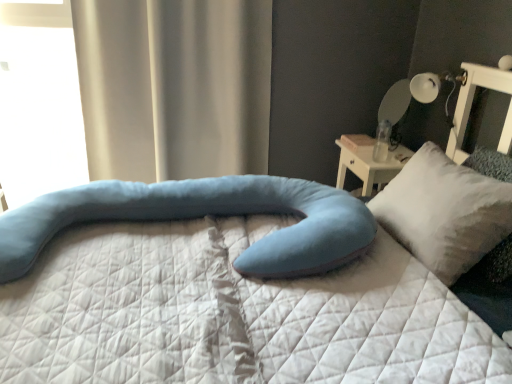
In order to face soft blue fabric pillow at center, marked as the 1th pillow in a left-to-right arrangement, should I rotate leftwards or rightwards?

Turn left approximately 9.121 degrees to face it.

How much space does soft blue fabric pillow at center, placed as the 2th pillow when sorted from right to left, occupy horizontally?

4.47 feet.

The image size is (512, 384). Describe the element at coordinates (433, 87) in the screenshot. I see `white glossy table lamp at upper right` at that location.

You are a GUI agent. You are given a task and a screenshot of the screen. Output one action in this format:
    pyautogui.click(x=<x>, y=<y>)
    Task: Click on the white soft pillow at right, which ranks as the 1th pillow in right-to-left order
    
    Given the screenshot: What is the action you would take?
    pyautogui.click(x=444, y=212)

Is transparent glass window at upper left shorter than white glossy table lamp at upper right?

No.

From a real-world perspective, who is located lower, transparent glass window at upper left or white glossy table lamp at upper right?

transparent glass window at upper left.

Would you say white glossy table lamp at upper right is part of transparent glass window at upper left's contents?

No, white glossy table lamp at upper right is located outside of transparent glass window at upper left.

Considering the relative sizes of transparent glass window at upper left and white glossy table lamp at upper right in the image provided, is transparent glass window at upper left bigger than white glossy table lamp at upper right?

Indeed, transparent glass window at upper left has a larger size compared to white glossy table lamp at upper right.

Is white soft pillow at right, which ranks as the 1th pillow in right-to-left order, with transparent glass window at upper left?

No, white soft pillow at right, which ranks as the 1th pillow in right-to-left order, is not beside transparent glass window at upper left.

Is white soft pillow at right, arranged as the second pillow when viewed from the left, at the left side of transparent glass window at upper left?

No, white soft pillow at right, arranged as the second pillow when viewed from the left, is not to the left of transparent glass window at upper left.

Is point (483, 182) closer or farther from the camera than point (34, 15)?

Point (483, 182).

The width and height of the screenshot is (512, 384). I want to click on the 2nd pillow to the right of the transparent glass window at upper left, starting your count from the anchor, so click(x=444, y=212).

Is white soft pillow at right, which ranks as the 1th pillow in right-to-left order, taller or shorter than white glossy table lamp at upper right?

Considering their sizes, white soft pillow at right, which ranks as the 1th pillow in right-to-left order, has more height than white glossy table lamp at upper right.

Can we say white soft pillow at right, arranged as the second pillow when viewed from the left, lies outside white glossy table lamp at upper right?

white soft pillow at right, arranged as the second pillow when viewed from the left, lies outside white glossy table lamp at upper right's area.

From a real-world perspective, is white soft pillow at right, arranged as the second pillow when viewed from the left, over white glossy table lamp at upper right?

Incorrect, from a real-world perspective, white soft pillow at right, arranged as the second pillow when viewed from the left, is lower than white glossy table lamp at upper right.

Find the location of a particular element. table lamp above the white soft pillow at right, arranged as the second pillow when viewed from the left (from the image's perspective) is located at coordinates (433, 87).

Is satin beige curtain at upper left next to transparent glass window at upper left and touching it?

No, satin beige curtain at upper left is not with transparent glass window at upper left.

Which is behind, satin beige curtain at upper left or transparent glass window at upper left?

Positioned behind is transparent glass window at upper left.

How many degrees apart are the facing directions of satin beige curtain at upper left and transparent glass window at upper left?

They differ by 0.155 degrees in their facing directions.

From the image's perspective, which one is positioned higher, satin beige curtain at upper left or transparent glass window at upper left?

transparent glass window at upper left is shown above in the image.

Is soft blue fabric pillow at center, marked as the 1th pillow in a left-to-right arrangement, at the back of transparent glass window at upper left?

No, transparent glass window at upper left is not facing away from soft blue fabric pillow at center, marked as the 1th pillow in a left-to-right arrangement.

From the picture: Between transparent glass window at upper left and soft blue fabric pillow at center, marked as the 1th pillow in a left-to-right arrangement, which one has larger size?

soft blue fabric pillow at center, marked as the 1th pillow in a left-to-right arrangement, is bigger.

From a real-world perspective, who is located lower, transparent glass window at upper left or soft blue fabric pillow at center, marked as the 1th pillow in a left-to-right arrangement?

soft blue fabric pillow at center, marked as the 1th pillow in a left-to-right arrangement.

Is transparent glass window at upper left completely or partially outside of soft blue fabric pillow at center, marked as the 1th pillow in a left-to-right arrangement?

Yes, transparent glass window at upper left is located beyond the bounds of soft blue fabric pillow at center, marked as the 1th pillow in a left-to-right arrangement.

Is soft blue fabric pillow at center, placed as the 2th pillow when sorted from right to left, shorter than white soft pillow at right, arranged as the second pillow when viewed from the left?

Indeed, soft blue fabric pillow at center, placed as the 2th pillow when sorted from right to left, has a lesser height compared to white soft pillow at right, arranged as the second pillow when viewed from the left.

Looking at the image, does soft blue fabric pillow at center, placed as the 2th pillow when sorted from right to left, seem bigger or smaller compared to white soft pillow at right, which ranks as the 1th pillow in right-to-left order?

Considering their sizes, soft blue fabric pillow at center, placed as the 2th pillow when sorted from right to left, takes up more space than white soft pillow at right, which ranks as the 1th pillow in right-to-left order.

Considering the positions of objects soft blue fabric pillow at center, placed as the 2th pillow when sorted from right to left, and white soft pillow at right, arranged as the second pillow when viewed from the left, in the image provided, who is more to the left, soft blue fabric pillow at center, placed as the 2th pillow when sorted from right to left, or white soft pillow at right, arranged as the second pillow when viewed from the left,?

Positioned to the left is soft blue fabric pillow at center, placed as the 2th pillow when sorted from right to left.

Is there a large distance between soft blue fabric pillow at center, placed as the 2th pillow when sorted from right to left, and white soft pillow at right, which ranks as the 1th pillow in right-to-left order?

Actually, soft blue fabric pillow at center, placed as the 2th pillow when sorted from right to left, and white soft pillow at right, which ranks as the 1th pillow in right-to-left order, are a little close together.

Could you measure the distance between transparent glass window at upper left and white soft pillow at right, arranged as the second pillow when viewed from the left?

transparent glass window at upper left is 2.41 meters from white soft pillow at right, arranged as the second pillow when viewed from the left.

Would you consider transparent glass window at upper left to be distant from white soft pillow at right, which ranks as the 1th pillow in right-to-left order?

Yes, transparent glass window at upper left and white soft pillow at right, which ranks as the 1th pillow in right-to-left order, are located far from each other.

Can you tell me how much transparent glass window at upper left and white soft pillow at right, which ranks as the 1th pillow in right-to-left order, differ in facing direction?

They differ by 86.8 degrees in their facing directions.

From the image's perspective, is transparent glass window at upper left beneath white soft pillow at right, which ranks as the 1th pillow in right-to-left order?

Actually, transparent glass window at upper left appears above white soft pillow at right, which ranks as the 1th pillow in right-to-left order, in the image.

Identify the location of window behind the white glossy table lamp at upper right. The image size is (512, 384). (39, 102).

The width and height of the screenshot is (512, 384). Identify the location of window located on the left of white soft pillow at right, which ranks as the 1th pillow in right-to-left order. (39, 102).

From the image, which object appears to be farther from white soft pillow at right, arranged as the second pillow when viewed from the left, transparent glass window at upper left or white glossy table lamp at upper right?

transparent glass window at upper left is further to white soft pillow at right, arranged as the second pillow when viewed from the left.

Based on the photo, when comparing their distances from transparent glass window at upper left, does white soft pillow at right, which ranks as the 1th pillow in right-to-left order, or white glossy table lamp at upper right seem closer?

white glossy table lamp at upper right is positioned closer to the anchor transparent glass window at upper left.

Based on their spatial positions, is satin beige curtain at upper left or white soft pillow at right, which ranks as the 1th pillow in right-to-left order, further from white glossy table lamp at upper right?

satin beige curtain at upper left lies further to white glossy table lamp at upper right than the other object.

Estimate the real-world distances between objects in this image. Which object is further from satin beige curtain at upper left, white soft pillow at right, which ranks as the 1th pillow in right-to-left order, or white glossy table lamp at upper right?

Based on the image, white glossy table lamp at upper right appears to be further to satin beige curtain at upper left.

Based on their spatial positions, is transparent glass window at upper left or soft blue fabric pillow at center, placed as the 2th pillow when sorted from right to left, closer to white glossy table lamp at upper right?

Based on the image, soft blue fabric pillow at center, placed as the 2th pillow when sorted from right to left, appears to be nearer to white glossy table lamp at upper right.

When comparing their distances from transparent glass window at upper left, does satin beige curtain at upper left or white soft pillow at right, arranged as the second pillow when viewed from the left, seem closer?

satin beige curtain at upper left is positioned closer to the anchor transparent glass window at upper left.

Looking at the image, which one is located closer to white soft pillow at right, which ranks as the 1th pillow in right-to-left order, soft blue fabric pillow at center, placed as the 2th pillow when sorted from right to left, or transparent glass window at upper left?

soft blue fabric pillow at center, placed as the 2th pillow when sorted from right to left, is positioned closer to the anchor white soft pillow at right, which ranks as the 1th pillow in right-to-left order.

Considering their positions, is white glossy table lamp at upper right positioned further to satin beige curtain at upper left than transparent glass window at upper left?

Among the two, white glossy table lamp at upper right is located further to satin beige curtain at upper left.

Locate an element on the screen. This screenshot has height=384, width=512. pillow between soft blue fabric pillow at center, placed as the 2th pillow when sorted from right to left, and white glossy table lamp at upper right is located at coordinates (444, 212).

Locate an element on the screen. This screenshot has width=512, height=384. pillow situated between transparent glass window at upper left and white soft pillow at right, which ranks as the 1th pillow in right-to-left order, from left to right is located at coordinates (203, 216).

Find the location of `curtain between soft blue fabric pillow at center, placed as the 2th pillow when sorted from right to left, and transparent glass window at upper left, along the z-axis`. curtain between soft blue fabric pillow at center, placed as the 2th pillow when sorted from right to left, and transparent glass window at upper left, along the z-axis is located at coordinates (174, 87).

Locate an element on the screen. This screenshot has height=384, width=512. pillow between satin beige curtain at upper left and white soft pillow at right, arranged as the second pillow when viewed from the left is located at coordinates [x=203, y=216].